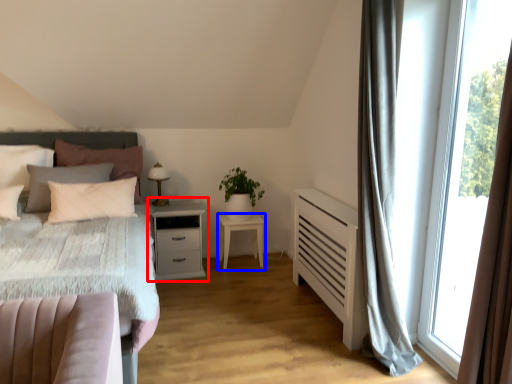
Question: Which point is further to the camera, nightstand (highlighted by a red box) or nightstand (highlighted by a blue box)?

Choices:
 (A) nightstand
 (B) nightstand

Answer: (B)